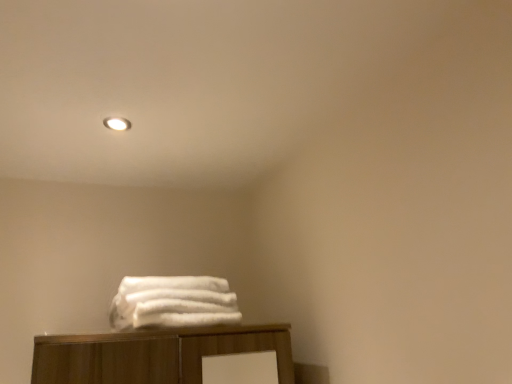
Question: Relative to matte white light fixture at upper center, is white fluffy towels at center in front or behind?

Choices:
 (A) behind
 (B) front

Answer: (B)

Question: Considering the positions of point (207, 289) and point (123, 127), is point (207, 289) closer or farther from the camera than point (123, 127)?

Choices:
 (A) closer
 (B) farther

Answer: (A)

Question: From a real-world perspective, relative to matte white light fixture at upper center, is white fluffy towels at center vertically above or below?

Choices:
 (A) below
 (B) above

Answer: (A)

Question: Relative to white fluffy towels at center, is matte white light fixture at upper center in front or behind?

Choices:
 (A) behind
 (B) front

Answer: (A)

Question: Does point (114, 125) appear closer or farther from the camera than point (223, 283)?

Choices:
 (A) farther
 (B) closer

Answer: (B)

Question: Looking at the image, does matte white light fixture at upper center seem bigger or smaller compared to white fluffy towels at center?

Choices:
 (A) small
 (B) big

Answer: (A)

Question: Is matte white light fixture at upper center to the left or to the right of white fluffy towels at center in the image?

Choices:
 (A) right
 (B) left

Answer: (B)